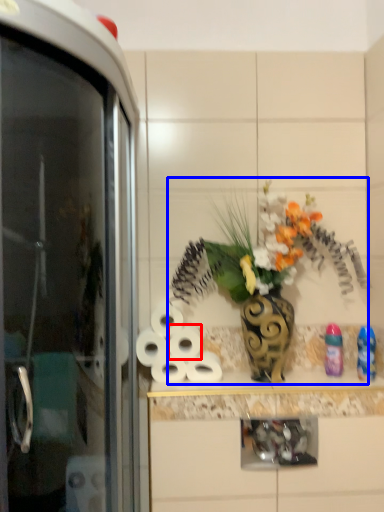
Question: Which of the following is the closest to the observer, toilet paper (highlighted by a red box) or floral arrangement (highlighted by a blue box)?

Choices:
 (A) toilet paper
 (B) floral arrangement

Answer: (B)